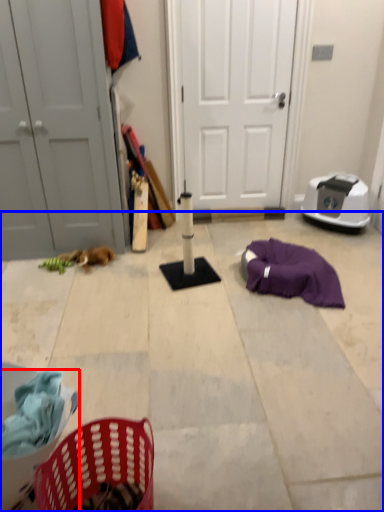
Question: Which point is closer to the camera, basket (highlighted by a red box) or concrete (highlighted by a blue box)?

Choices:
 (A) basket
 (B) concrete

Answer: (A)